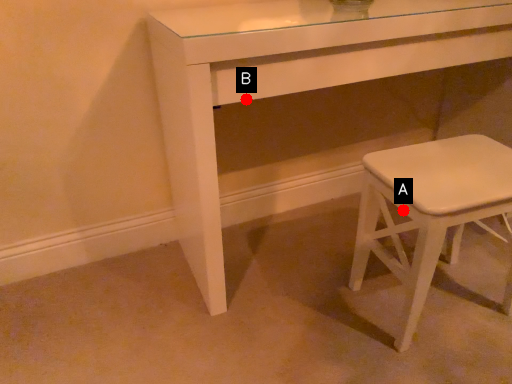
Question: Two points are circled on the image, labeled by A and B beside each circle. Which point is closer to the camera?

Choices:
 (A) A is closer
 (B) B is closer

Answer: (A)